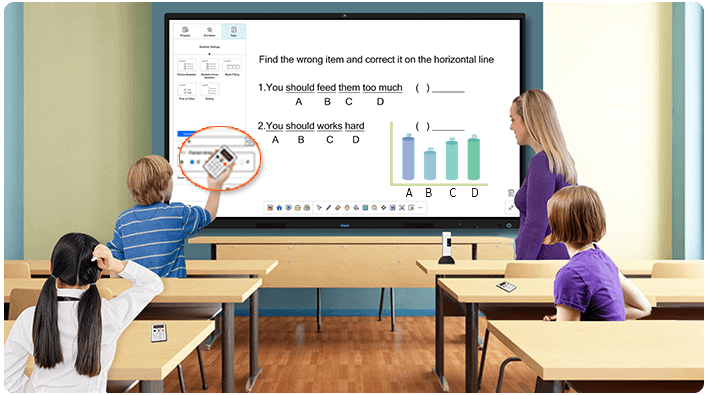
In order to click on desks in this screenshot , I will do `click(187, 340)`, `click(206, 273)`, `click(215, 262)`, `click(611, 351)`, `click(471, 287)`, `click(455, 262)`.